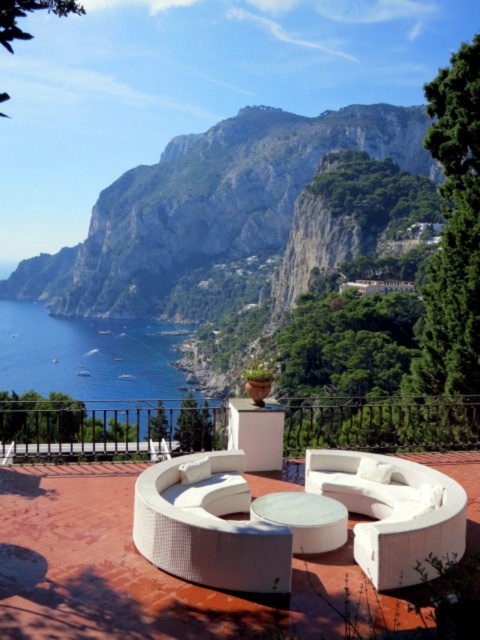
Is white fabric couch at center smaller than white glossy table at center?

Correct, white fabric couch at center occupies less space than white glossy table at center.

Who is more distant from viewer, (425, 563) or (289, 518)?

The point (289, 518) is more distant.

Image resolution: width=480 pixels, height=640 pixels. Find the location of `white fabric couch at center`. white fabric couch at center is located at coordinates (393, 513).

Does white fabric couch at center have a smaller size compared to blue water at lower left?

Yes, white fabric couch at center is smaller than blue water at lower left.

Is white fabric couch at center closer to the viewer compared to blue water at lower left?

Yes, it is in front of blue water at lower left.

Is point (435, 490) positioned after point (87, 321)?

No, (435, 490) is closer to viewer.

The image size is (480, 640). In order to click on white fabric couch at center in this screenshot , I will do `click(393, 513)`.

Is blue water at lower left smaller than white glossy table at center?

Incorrect, blue water at lower left is not smaller in size than white glossy table at center.

Between blue water at lower left and white glossy table at center, which one has more height?

blue water at lower left

Who is more distant from viewer, (3,314) or (279,492)?

The point (3,314) is behind.

This screenshot has width=480, height=640. Find the location of `blue water at lower left`. blue water at lower left is located at coordinates (86, 355).